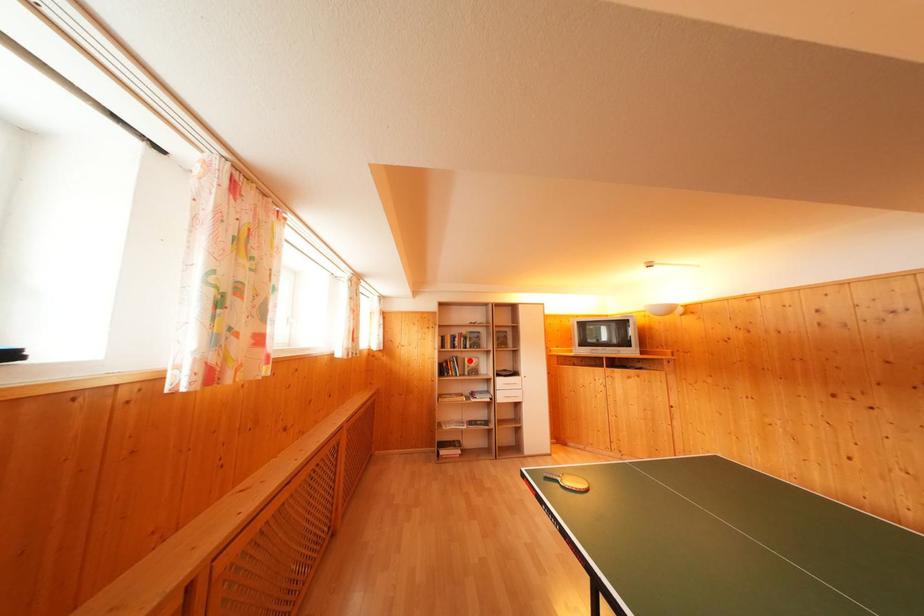
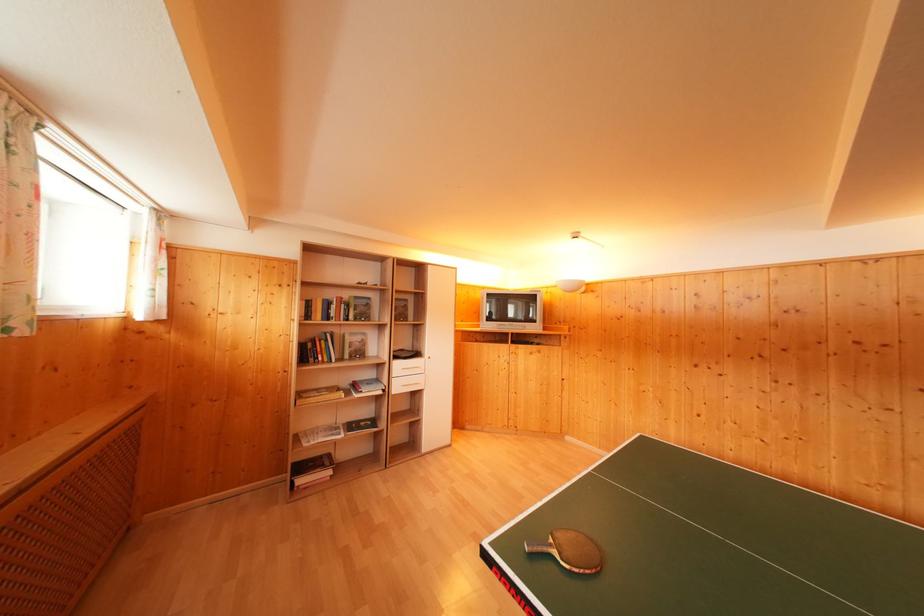
Question: I am providing you with two images of the same scene from different viewpoints. Image1 has a red point marked. In image2, the corresponding 3D location appears at what relative position? Reply with the corresponding letter.

Choices:
 (A) Closer
 (B) Farther

Answer: (A)